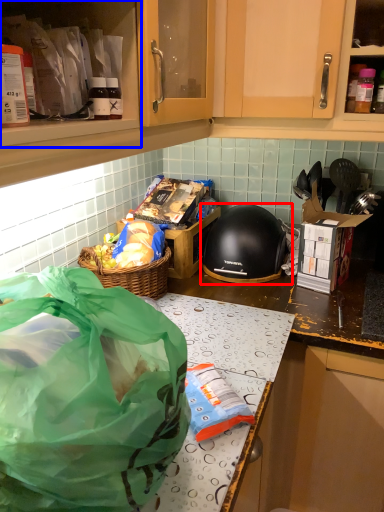
Question: Which object is closer to the camera taking this photo, helmet (highlighted by a red box) or cabinetry (highlighted by a blue box)?

Choices:
 (A) helmet
 (B) cabinetry

Answer: (B)